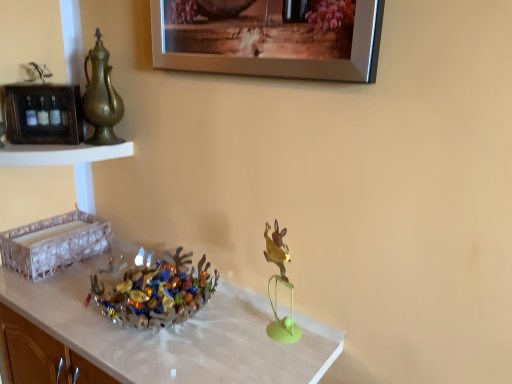
Find the location of a particular element. free point above white textured tray at upper left (from a real-world perspective) is located at coordinates (41, 146).